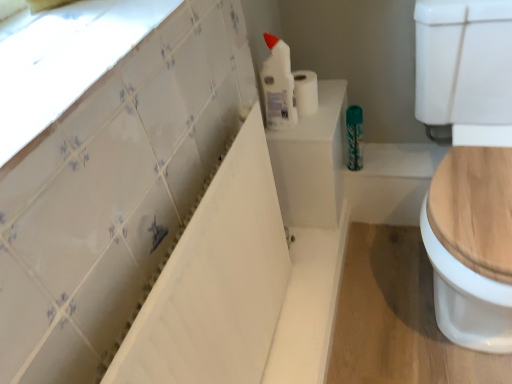
I want to click on vacant space to the right of teal metallic can at center, so click(x=399, y=158).